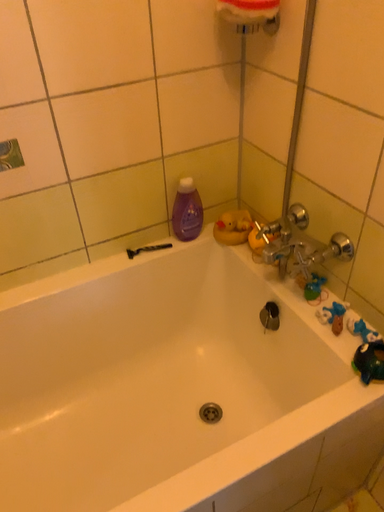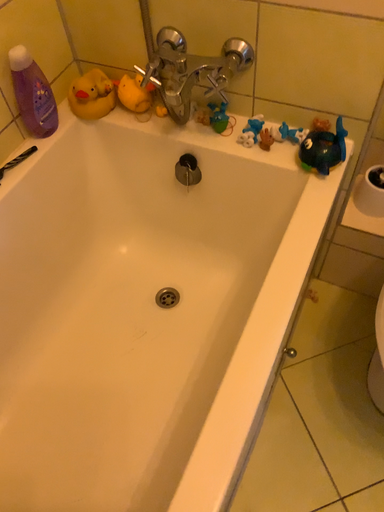
Question: Which way did the camera rotate in the video?

Choices:
 (A) rotated downward
 (B) rotated upward

Answer: (A)